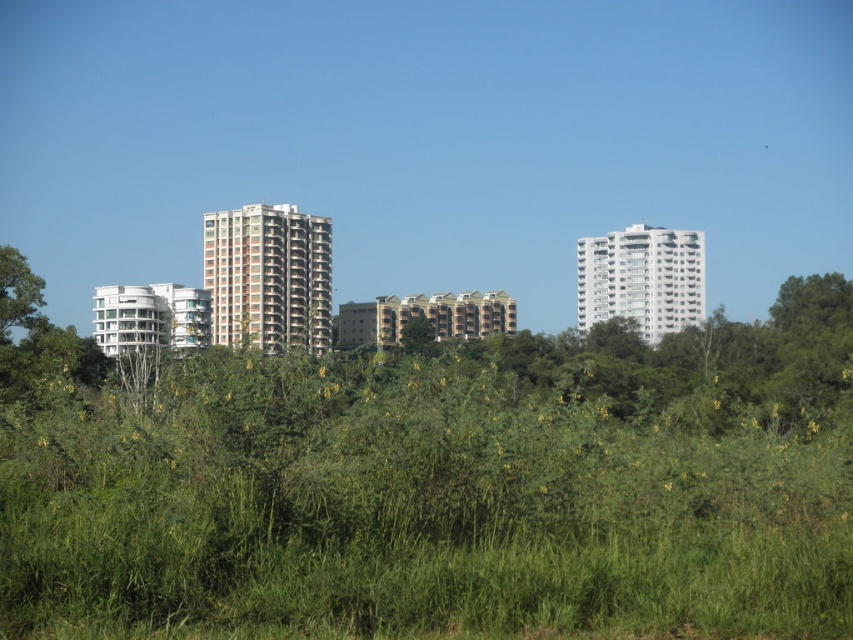
Looking at this image, you are standing in a park and see the white glossy building at upper right and the green leafy tree at left. Which object is higher in the scene?

The white glossy building at upper right is higher than the green leafy tree at left.

You are a city planner evaluating the view of the orange brick building at center and the green leafy tree at left. Which object would block the view of the sky more when standing in front of them?

The orange brick building at center is taller than the green leafy tree at left, so it would block the view of the sky more when standing in front of them.